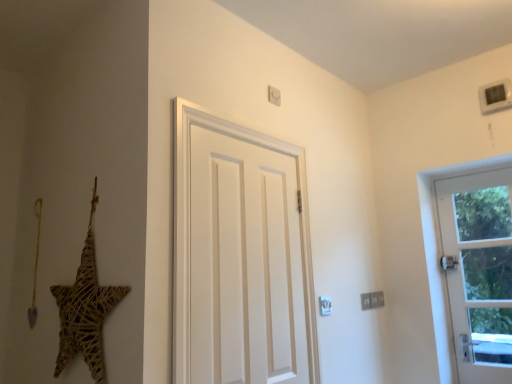
Question: Should I look upward or downward to see woven straw star at left?

Choices:
 (A) up
 (B) down

Answer: (B)

Question: Which direction should I rotate to look at white matte door at center, placed as the second door when sorted from back to front?

Choices:
 (A) left
 (B) right

Answer: (B)

Question: Considering the relative sizes of woven straw star at left and white glass door at right, the 1th door positioned from the back, in the image provided, is woven straw star at left smaller than white glass door at right, the 1th door positioned from the back,?

Choices:
 (A) no
 (B) yes

Answer: (B)

Question: From a real-world perspective, is woven straw star at left positioned under white glass door at right, the 1th door positioned from the back, based on gravity?

Choices:
 (A) no
 (B) yes

Answer: (A)

Question: Would you say white glass door at right, the first door from the right, is part of woven straw star at left's contents?

Choices:
 (A) no
 (B) yes

Answer: (A)

Question: From the image's perspective, is woven straw star at left below white glass door at right, placed as the 2th door when sorted from left to right?

Choices:
 (A) no
 (B) yes

Answer: (A)

Question: Is woven straw star at left thinner than white glass door at right, the 1th door positioned from the back?

Choices:
 (A) no
 (B) yes

Answer: (B)

Question: Does woven straw star at left have a larger size compared to white glass door at right, placed as the 2th door when sorted from left to right?

Choices:
 (A) no
 (B) yes

Answer: (A)

Question: Would you say white glass door at right, the first door from the right, is outside white matte door at center, which appears as the first door when viewed from the left?

Choices:
 (A) no
 (B) yes

Answer: (B)

Question: Is white glass door at right, the first door from the right, next to white matte door at center, the 1th door in the front-to-back sequence, and touching it?

Choices:
 (A) yes
 (B) no

Answer: (B)

Question: Can you confirm if white glass door at right, placed as the 2th door when sorted from left to right, is shorter than white matte door at center, placed as the second door when sorted from back to front?

Choices:
 (A) yes
 (B) no

Answer: (B)

Question: Is white glass door at right, which is the 2th door from front to back, wider than white matte door at center, which appears as the first door when viewed from the left?

Choices:
 (A) yes
 (B) no

Answer: (A)

Question: From a real-world perspective, is white glass door at right, the first door from the right, beneath white matte door at center, which appears as the first door when viewed from the left?

Choices:
 (A) yes
 (B) no

Answer: (A)

Question: Can you confirm if white glass door at right, which is the 2th door from front to back, is positioned to the left of white matte door at center, the 1th door in the front-to-back sequence?

Choices:
 (A) no
 (B) yes

Answer: (A)

Question: Does white matte door at center, which appears as the first door when viewed from the left, have a lesser height compared to woven straw star at left?

Choices:
 (A) no
 (B) yes

Answer: (A)